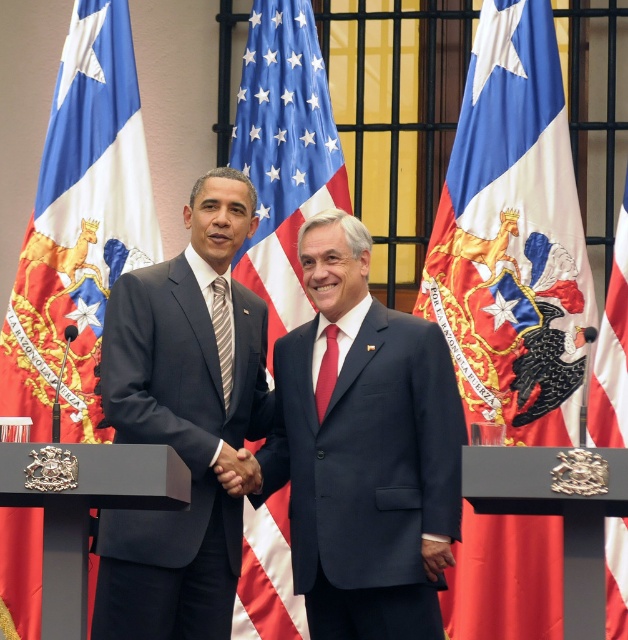
You are an event planner setting up a stage for a diplomatic meeting. The stage has three podiums arranged in a row. The podium on the left has a Chilean flag, the center podium has a red fabric flag at center, and the right podium has another Chilean flag. You need to place a banner exactly halfway between the left and right podiums. According to the image, where should you place the banner?

The banner should be placed at the same position as the red fabric flag at center, which is at point [612,349], since it is located exactly between the two Chilean flags on the left and right podiums.

You are an event photographer who needs to capture a closeup shot of the American flag in the center. You see a point marked at coordinates (512, 236). Is this point located on the American flag?

The point (512, 236) is on the silk flag at center, which is the American flag in the center. Yes, the point is located on the American flag.

You are a photographer positioned at the center of the room. You want to take a photo of the silk flag at center and the matte black suit at left. Given that your camera has a maximum focus range of 35 feet, will you be able to capture both subjects in focus without moving?

The silk flag at center and matte black suit at left are 38.26 feet apart. Since the maximum focus range of the camera is 35 feet, the distance between them exceeds this limit. Therefore, you will not be able to capture both subjects in focus without moving closer or adjusting your position.